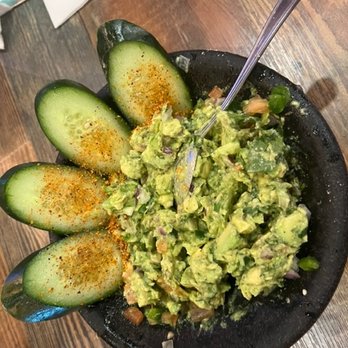
This screenshot has width=348, height=348. I want to click on bowl, so click(240, 68).